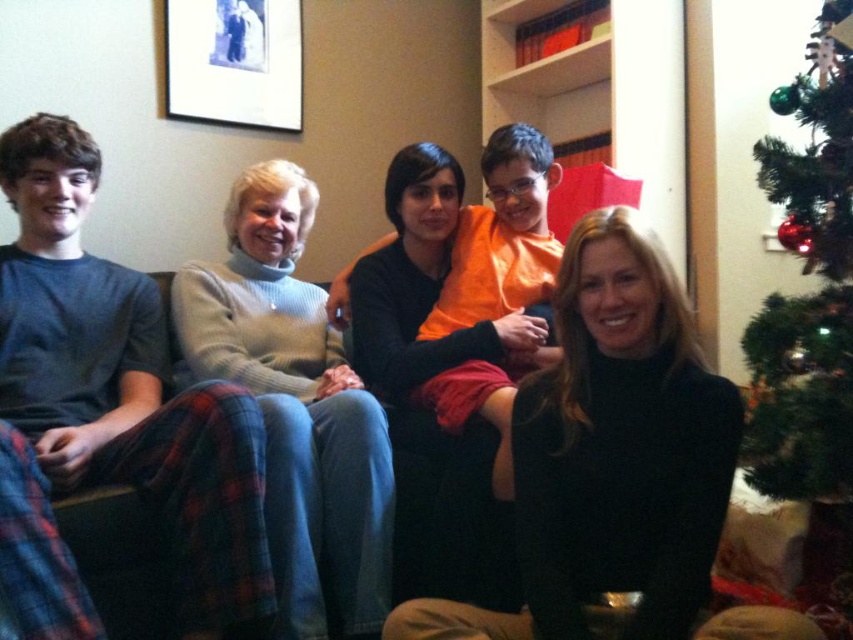
Question: Which point is closer to the camera?

Choices:
 (A) (602, 493)
 (B) (277, 13)

Answer: (A)

Question: Is matte black sweater at center positioned at the back of black turtleneck sweater at center?

Choices:
 (A) yes
 (B) no

Answer: (B)

Question: Is matte black sweater at center positioned at the back of black turtleneck sweater at center?

Choices:
 (A) yes
 (B) no

Answer: (B)

Question: Which point appears closest to the camera in this image?

Choices:
 (A) (840, 428)
 (B) (596, 381)
 (C) (218, 70)
 (D) (335, 356)

Answer: (B)

Question: Is black turtleneck sweater at center closer to the viewer compared to black matte picture frame at upper left?

Choices:
 (A) no
 (B) yes

Answer: (B)

Question: Based on their relative distances, which object is nearer to the matte black sweater at center?

Choices:
 (A) green artificial tree at right
 (B) light gray turtleneck sweater at center

Answer: (B)